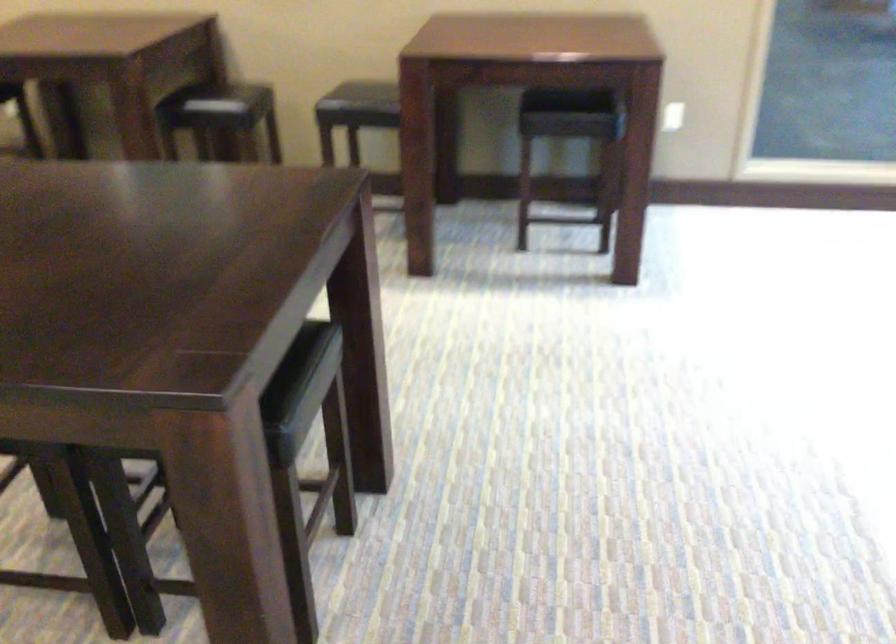
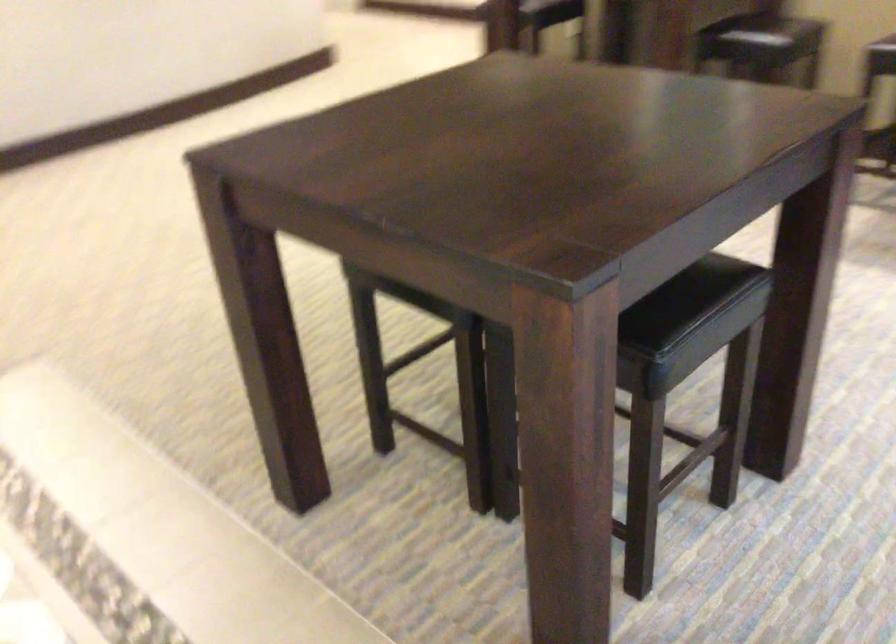
Question: The images are taken continuously from a first-person perspective. In which direction is your viewpoint rotating?

Choices:
 (A) Left
 (B) Right
 (C) Up
 (D) Down

Answer: (A)